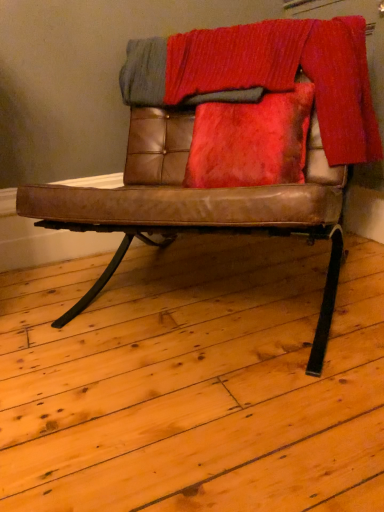
Locate an element on the screen. Image resolution: width=384 pixels, height=512 pixels. brown leather chair at center is located at coordinates (193, 205).

Describe the element at coordinates (193, 205) in the screenshot. I see `brown leather chair at center` at that location.

Describe the element at coordinates (265, 74) in the screenshot. The width and height of the screenshot is (384, 512). I see `knitted wool blanket at upper center` at that location.

At what (x,y) coordinates should I click in order to perform the action: click on knitted wool blanket at upper center. Please return your answer as a coordinate pair (x, y). Looking at the image, I should click on (265, 74).

Measure the distance between point (170, 77) and camera.

Point (170, 77) and camera are 1.45 meters apart from each other.

This screenshot has width=384, height=512. What are the coordinates of `brown leather chair at center` in the screenshot? It's located at (193, 205).

Considering the positions of objects brown leather chair at center and knitted wool blanket at upper center in the image provided, who is more to the left, brown leather chair at center or knitted wool blanket at upper center?

Positioned to the left is brown leather chair at center.

Is brown leather chair at center further to camera compared to knitted wool blanket at upper center?

That is False.

Which is further, (286,191) or (175,77)?

The point (175,77) is behind.

From the image's perspective, which object appears higher, brown leather chair at center or knitted wool blanket at upper center?

knitted wool blanket at upper center appears higher in the image.

From a real-world perspective, which is physically above, brown leather chair at center or knitted wool blanket at upper center?

In real-world perspective, knitted wool blanket at upper center is above.

In terms of width, does brown leather chair at center look wider or thinner when compared to knitted wool blanket at upper center?

Clearly, brown leather chair at center has more width compared to knitted wool blanket at upper center.

From their relative heights in the image, would you say brown leather chair at center is taller or shorter than knitted wool blanket at upper center?

Clearly, brown leather chair at center is taller compared to knitted wool blanket at upper center.

Considering the relative sizes of brown leather chair at center and knitted wool blanket at upper center in the image provided, is brown leather chair at center smaller than knitted wool blanket at upper center?

No, brown leather chair at center is not smaller than knitted wool blanket at upper center.

Is brown leather chair at center inside the boundaries of knitted wool blanket at upper center, or outside?

brown leather chair at center is spatially situated outside knitted wool blanket at upper center.

Is there a large distance between brown leather chair at center and knitted wool blanket at upper center?

No, brown leather chair at center is not far from knitted wool blanket at upper center.

In the scene shown: Is brown leather chair at center turned away from knitted wool blanket at upper center?

Yes, brown leather chair at center is facing away from knitted wool blanket at upper center.

How many degrees apart are the facing directions of brown leather chair at center and knitted wool blanket at upper center?

brown leather chair at center and knitted wool blanket at upper center are facing 0.00117 degrees away from each other.

Locate an element on the screen. This screenshot has height=512, width=384. chair that is below the knitted wool blanket at upper center (from the image's perspective) is located at coordinates (193, 205).

Is knitted wool blanket at upper center at the left side of brown leather chair at center?

Incorrect, knitted wool blanket at upper center is not on the left side of brown leather chair at center.

Is knitted wool blanket at upper center closer to camera compared to brown leather chair at center?

No, it is behind brown leather chair at center.

Considering the positions of point (354, 26) and point (151, 190), is point (354, 26) closer or farther from the camera than point (151, 190)?

Point (354, 26).

From the image's perspective, is knitted wool blanket at upper center on brown leather chair at center?

Indeed, from the image's perspective, knitted wool blanket at upper center is shown above brown leather chair at center.

From a real-world perspective, is knitted wool blanket at upper center below brown leather chair at center?

No.

Which of these two, knitted wool blanket at upper center or brown leather chair at center, is thinner?

Thinner between the two is knitted wool blanket at upper center.

Which of these two, knitted wool blanket at upper center or brown leather chair at center, stands taller?

Standing taller between the two is brown leather chair at center.

Considering the relative sizes of knitted wool blanket at upper center and brown leather chair at center in the image provided, is knitted wool blanket at upper center smaller than brown leather chair at center?

Correct, knitted wool blanket at upper center occupies less space than brown leather chair at center.

Is knitted wool blanket at upper center positioned beyond the bounds of brown leather chair at center?

No.

Is knitted wool blanket at upper center far from brown leather chair at center?

No, knitted wool blanket at upper center is not far from brown leather chair at center.

Consider the image. Is knitted wool blanket at upper center oriented away from brown leather chair at center?

Yes, knitted wool blanket at upper center is positioned with its back facing brown leather chair at center.

How different are the orientations of knitted wool blanket at upper center and brown leather chair at center in degrees?

There is a 0.00117-degree angle between the facing directions of knitted wool blanket at upper center and brown leather chair at center.

I want to click on blanket above the brown leather chair at center (from the image's perspective), so click(x=265, y=74).

You are a GUI agent. You are given a task and a screenshot of the screen. Output one action in this format:
    pyautogui.click(x=<x>, y=<y>)
    Task: Click on the chair located in front of the knitted wool blanket at upper center
    
    Given the screenshot: What is the action you would take?
    pyautogui.click(x=193, y=205)

The width and height of the screenshot is (384, 512). Identify the location of blanket located above the brown leather chair at center (from a real-world perspective). (265, 74).